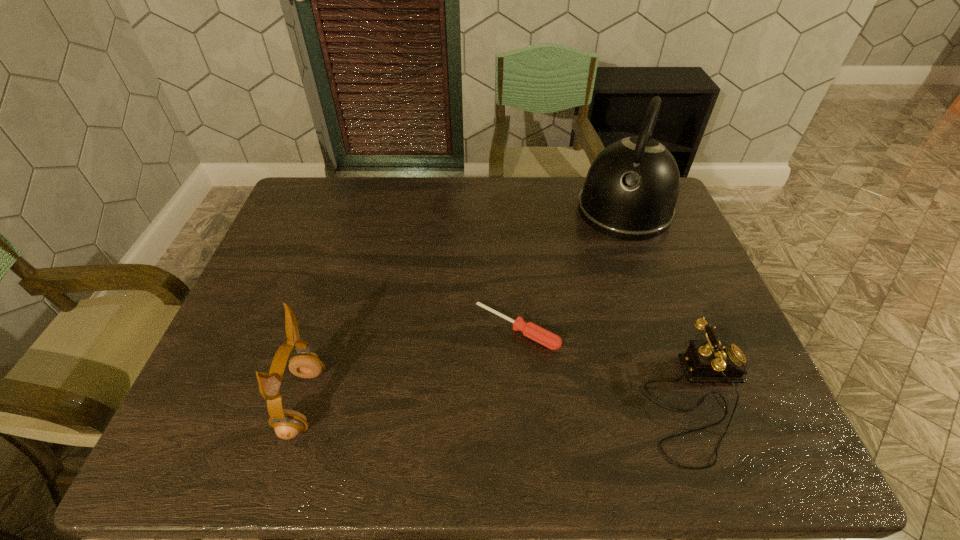
The height and width of the screenshot is (540, 960). I want to click on vacant spot on the desktop that is between the leftmost object and the third tallest object and is positioned on the spout of the tallest object, so click(555, 402).

I want to click on vacant space on the desktop that is between the third shortest object and the second shortest object and is positioned at the tip of the screwdriver, so click(461, 402).